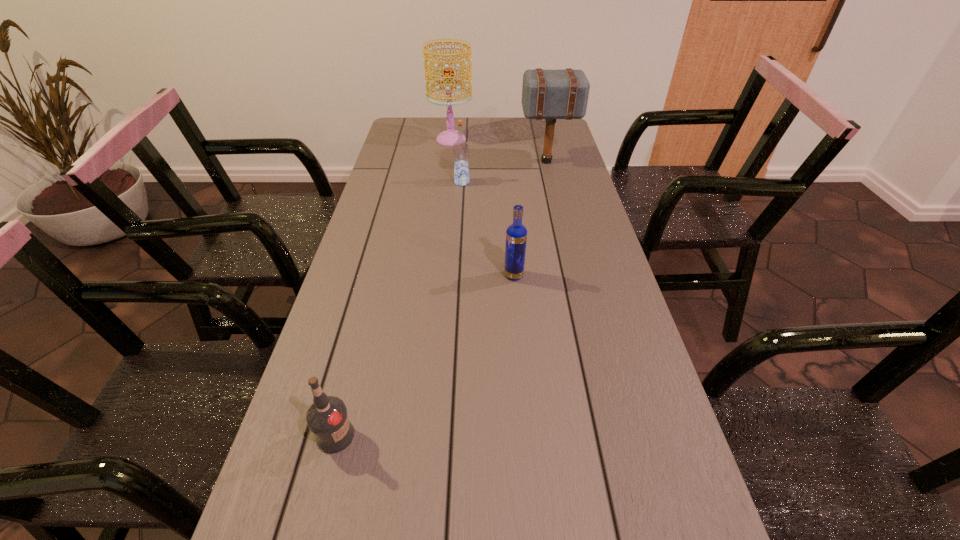
Where is `the farthest object`? This screenshot has width=960, height=540. the farthest object is located at coordinates (450, 136).

What are the coordinates of `mallet` in the screenshot? It's located at (546, 94).

Identify the location of the rightmost object. (546, 94).

Locate an element on the screen. This screenshot has width=960, height=540. the third farthest object is located at coordinates (460, 148).

Where is `the second vodka from right to left`? the second vodka from right to left is located at coordinates (460, 148).

You are a GUI agent. You are given a task and a screenshot of the screen. Output one action in this format:
    pyautogui.click(x=<x>, y=<y>)
    Task: Click on the rightmost vodka
    Image resolution: width=960 pixels, height=540 pixels.
    Given the screenshot: What is the action you would take?
    pyautogui.click(x=516, y=235)

Locate an element on the screen. The image size is (960, 540). the fourth object from left to right is located at coordinates (516, 235).

You are a GUI agent. You are given a task and a screenshot of the screen. Output one action in this format:
    pyautogui.click(x=<x>, y=<y>)
    Task: Click on the shortest vodka
    Image resolution: width=960 pixels, height=540 pixels.
    Given the screenshot: What is the action you would take?
    pyautogui.click(x=327, y=418)

The height and width of the screenshot is (540, 960). Identify the location of the nearest object. (327, 418).

The width and height of the screenshot is (960, 540). I want to click on vacant space positioned on the front of the lampshade, so click(445, 194).